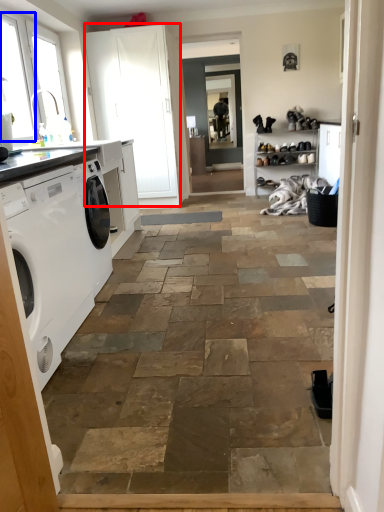
Question: Among these objects, which one is farthest to the camera, screen door (highlighted by a red box) or window (highlighted by a blue box)?

Choices:
 (A) screen door
 (B) window

Answer: (A)